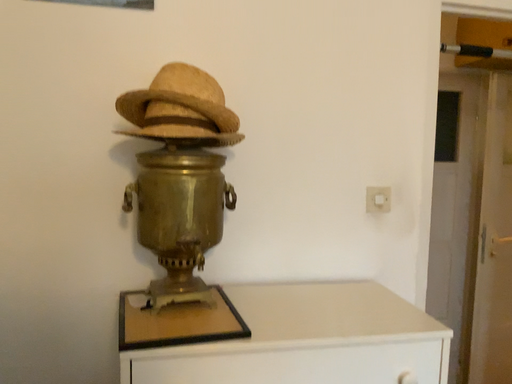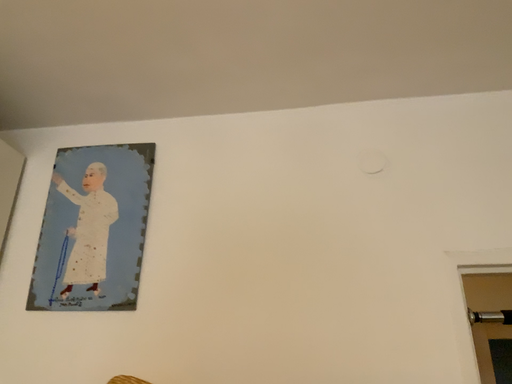
Question: How did the camera likely rotate when shooting the video?

Choices:
 (A) rotated downward
 (B) rotated upward

Answer: (B)